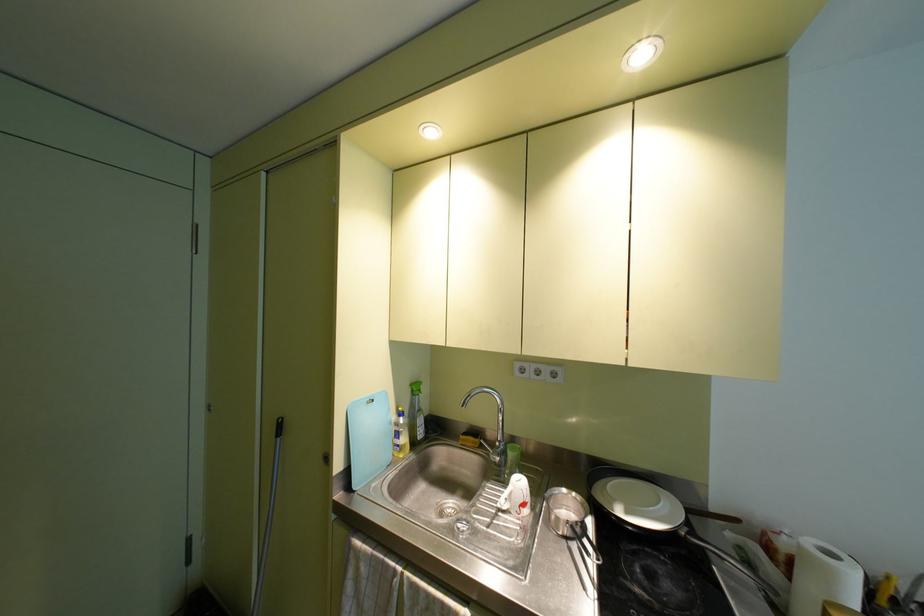
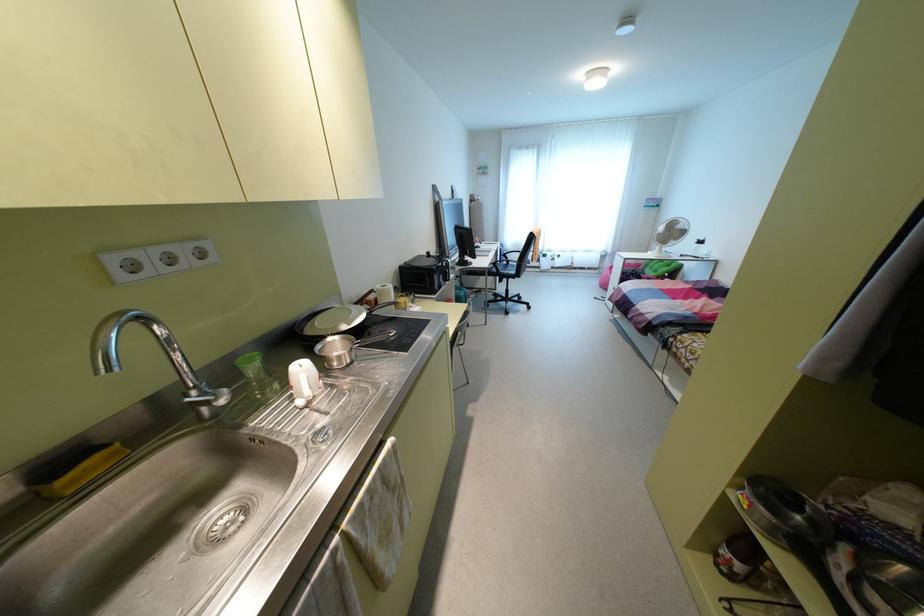
Question: I am providing you with two images of the same scene from different viewpoints. After the viewpoint changes to image2, which objects are now occluded?

Choices:
 (A) chair sitting surface
 (B) white electric fan
 (C) yellow kitchen sponge
 (D) none of these

Answer: (D)